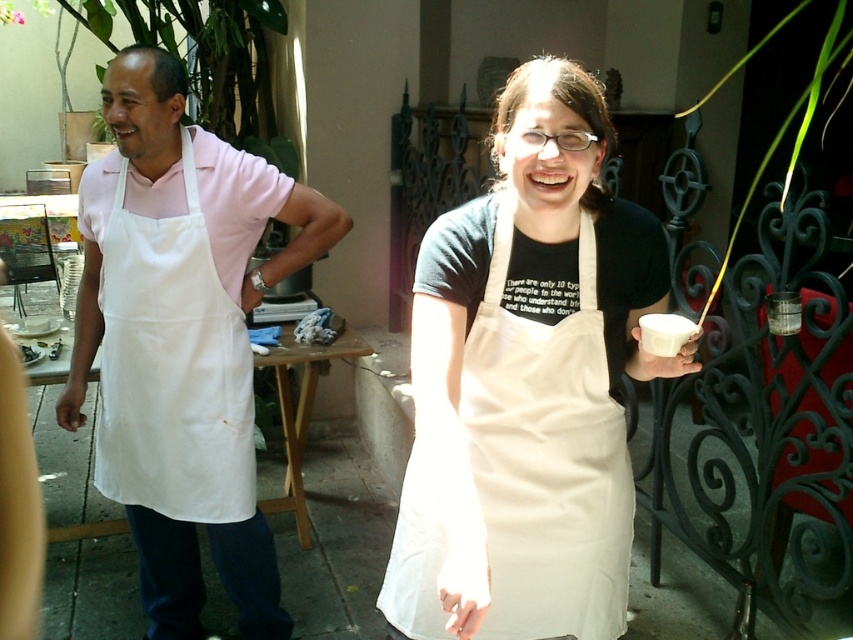
Question: Among these objects, which one is nearest to the camera?

Choices:
 (A) white apron at left
 (B) white paper cup at center

Answer: (B)

Question: Does white cotton apron at left come behind white paper cup at center?

Choices:
 (A) no
 (B) yes

Answer: (B)

Question: In this image, where is white apron at left located relative to white cotton apron at left?

Choices:
 (A) right
 (B) left

Answer: (A)

Question: Which is nearer to the white paper cup at center?

Choices:
 (A) white apron at left
 (B) white cotton apron at center
 (C) white cotton apron at left

Answer: (B)

Question: Does white cotton apron at left have a greater width compared to white paper cup at center?

Choices:
 (A) yes
 (B) no

Answer: (A)

Question: Which point is closer to the camera taking this photo?

Choices:
 (A) [x=167, y=486]
 (B) [x=654, y=349]
 (C) [x=131, y=340]
 (D) [x=461, y=337]

Answer: (B)